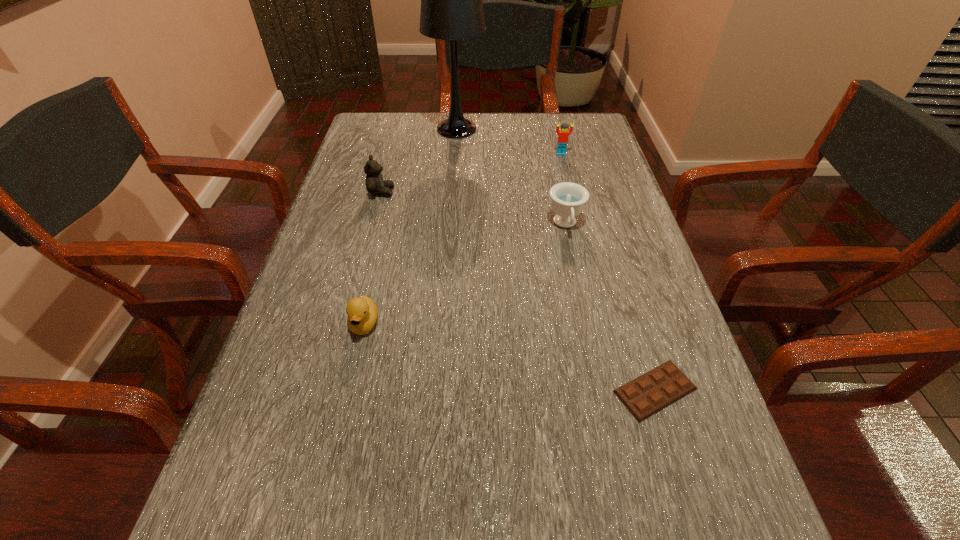
You are a GUI agent. You are given a task and a screenshot of the screen. Output one action in this format:
    pyautogui.click(x=<x>, y=<y>)
    Task: Click on the third object from left to right
    This screenshot has width=960, height=540.
    Given the screenshot: What is the action you would take?
    pyautogui.click(x=451, y=0)

I want to click on the farthest object, so click(x=451, y=0).

Identify the location of the fourth nearest object. (375, 184).

This screenshot has width=960, height=540. Identify the location of the fifth nearest object. (563, 134).

Locate an element on the screen. The height and width of the screenshot is (540, 960). teacup is located at coordinates point(568,199).

Identify the location of the second nearest object. (362, 311).

You are a GUI agent. You are given a task and a screenshot of the screen. Output one action in this format:
    pyautogui.click(x=<x>, y=<y>)
    Task: Click on the chocolate bar
    
    Given the screenshot: What is the action you would take?
    pyautogui.click(x=648, y=394)

The width and height of the screenshot is (960, 540). Identify the location of the shortest object. (648, 394).

At what (x,y) coordinates should I click in order to perform the action: click on free space located 0.120m on the front of the tallest object. Please return your answer as a coordinate pair (x, y). The height and width of the screenshot is (540, 960). Looking at the image, I should click on (454, 165).

Image resolution: width=960 pixels, height=540 pixels. What are the coordinates of `vacant space located 0.310m on the face of the third farthest object` in the screenshot? It's located at (514, 192).